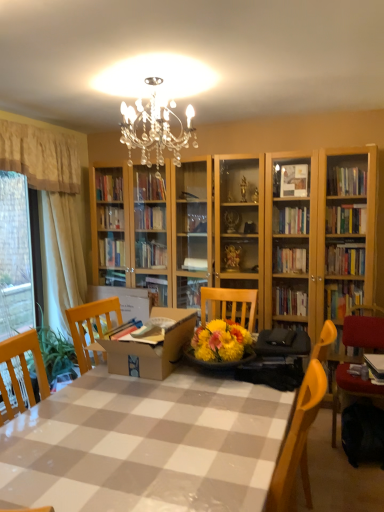
Image resolution: width=384 pixels, height=512 pixels. What are the coordinates of `free space in front of cardboard box at center` in the screenshot? It's located at (167, 409).